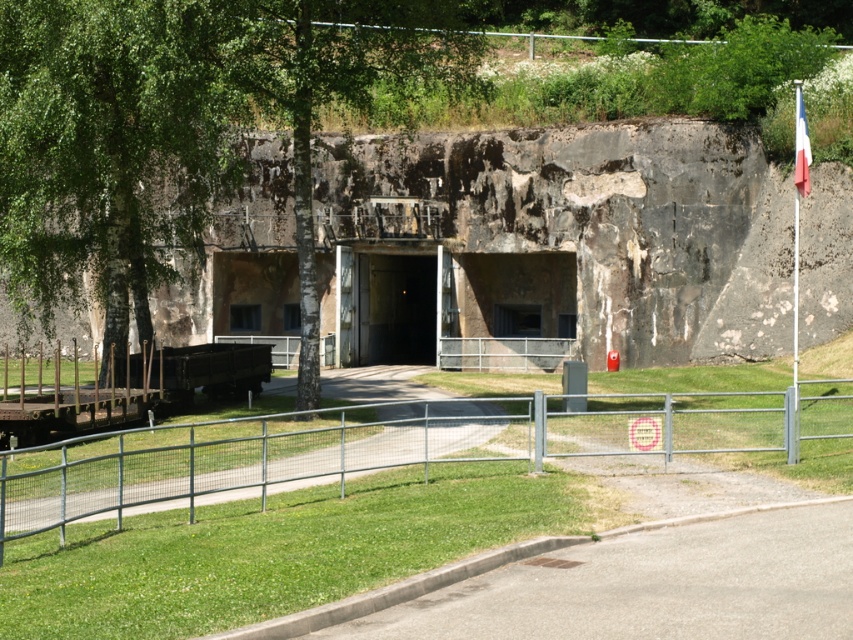
Question: Which is farther from the dark gray concrete tunnel at center?

Choices:
 (A) green leafy tree at center
 (B) concrete bunker entrance at center
 (C) french flag at upper right

Answer: (C)

Question: Among these objects, which one is farthest from the camera?

Choices:
 (A) metal/grey fence at lower center
 (B) green leafy tree at center

Answer: (B)

Question: Is metal/grey fence at lower center bigger than green leafy tree at center?

Choices:
 (A) yes
 (B) no

Answer: (B)

Question: Which object is positioned farthest from the french flag at upper right?

Choices:
 (A) green leafy tree at center
 (B) dark gray concrete tunnel at center

Answer: (B)

Question: Can you confirm if metal/grey fence at lower center is bigger than green leafy tree at center?

Choices:
 (A) no
 (B) yes

Answer: (A)

Question: Is concrete bunker entrance at center positioned in front of french flag at upper right?

Choices:
 (A) no
 (B) yes

Answer: (A)